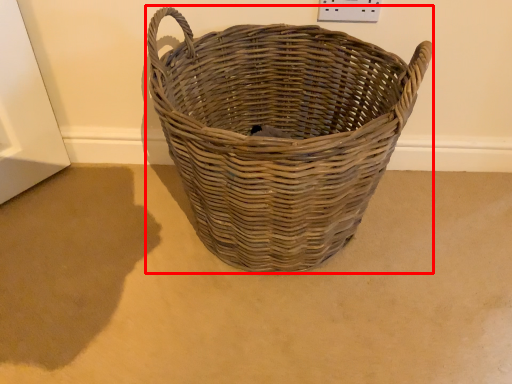
Question: From the image's perspective, where is picnic basket (annotated by the red box) located in relation to plain in the image?

Choices:
 (A) below
 (B) above

Answer: (B)